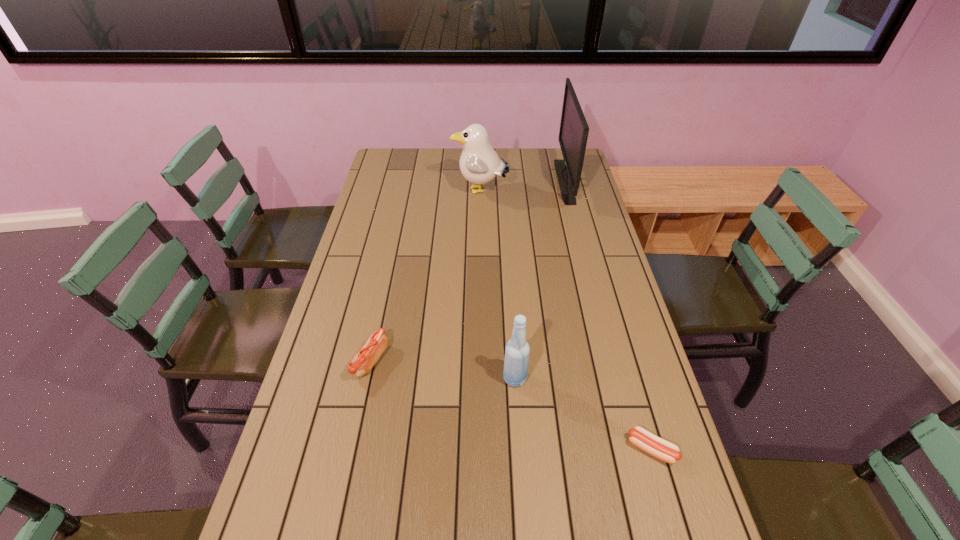
At what (x,y) coordinates should I click in order to perform the action: click on object that is at the far right corner. Please return your answer as a coordinate pair (x, y). This screenshot has width=960, height=540. Looking at the image, I should click on (573, 134).

At what (x,y) coordinates should I click in order to perform the action: click on free spot at the left edge of the desktop. Please return your answer as a coordinate pair (x, y). Looking at the image, I should click on tap(347, 309).

This screenshot has width=960, height=540. I want to click on free region at the right edge, so click(595, 278).

Identify the location of vacant space at the far left corner of the desktop. The height and width of the screenshot is (540, 960). (404, 169).

Where is `empty location between the shortest object and the third shortest object`? This screenshot has height=540, width=960. empty location between the shortest object and the third shortest object is located at coordinates (584, 414).

Identify the location of vacant area that lies between the tallest object and the shortest object. (608, 315).

Identify the location of vacant space that's between the shortest object and the third shortest object. (584, 414).

Find the location of a particular element. vacant point located between the leftmost object and the tallest object is located at coordinates tap(468, 271).

Find the location of a particular element. The width and height of the screenshot is (960, 540). unoccupied position between the nearest object and the gull is located at coordinates (566, 320).

Find the location of a particular element. The height and width of the screenshot is (540, 960). free space between the third shortest object and the farther sausage is located at coordinates (443, 370).